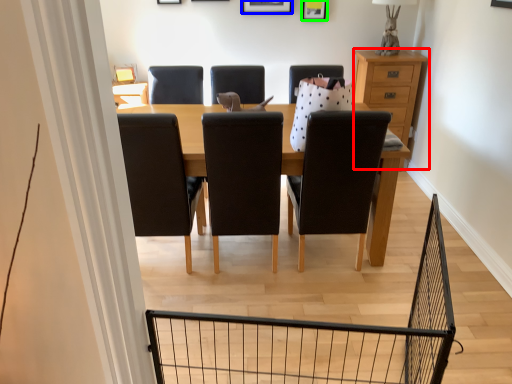
Question: Which is farther away from chest of drawers (highlighted by a red box)? picture frame (highlighted by a blue box) or picture frame (highlighted by a green box)?

Choices:
 (A) picture frame
 (B) picture frame

Answer: (A)